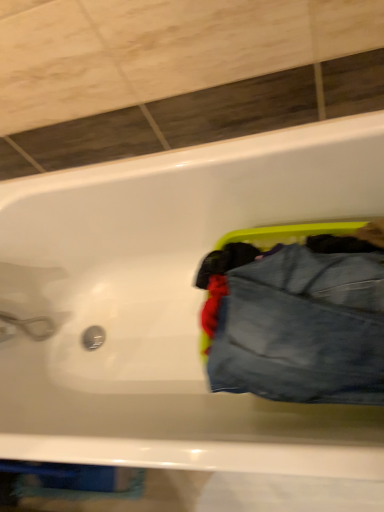
Question: Is denim at right taller or shorter than white glossy bathtub at upper center?

Choices:
 (A) tall
 (B) short

Answer: (B)

Question: Based on their sizes in the image, would you say denim at right is bigger or smaller than white glossy bathtub at upper center?

Choices:
 (A) big
 (B) small

Answer: (B)

Question: Considering the positions of point [379, 318] and point [1, 186], is point [379, 318] closer or farther from the camera than point [1, 186]?

Choices:
 (A) farther
 (B) closer

Answer: (B)

Question: Is white glossy bathtub at upper center inside or outside of denim at right?

Choices:
 (A) inside
 (B) outside

Answer: (B)

Question: Relative to denim at right, is white glossy bathtub at upper center in front or behind?

Choices:
 (A) behind
 (B) front

Answer: (B)

Question: From the image's perspective, is white glossy bathtub at upper center positioned above or below denim at right?

Choices:
 (A) below
 (B) above

Answer: (A)

Question: From a real-world perspective, relative to denim at right, is white glossy bathtub at upper center vertically above or below?

Choices:
 (A) above
 (B) below

Answer: (B)